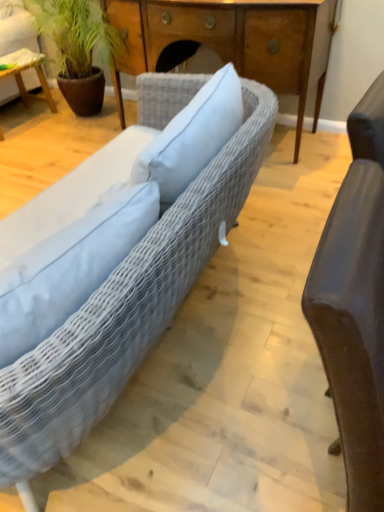
Question: From a real-world perspective, is matte brown leather chair at right positioned above or below green leafy plant at upper left?

Choices:
 (A) above
 (B) below

Answer: (A)

Question: Considering their positions, is matte brown leather chair at right located in front of or behind green leafy plant at upper left?

Choices:
 (A) front
 (B) behind

Answer: (A)

Question: Which of these objects is positioned farthest from the matte brown leather chair at right?

Choices:
 (A) wooden table at left
 (B) woven fabric couch at center
 (C) green leafy plant at upper left
 (D) wooden desk at center

Answer: (A)

Question: Which object is positioned closest to the green leafy plant at upper left?

Choices:
 (A) woven fabric couch at center
 (B) wooden desk at center
 (C) matte brown leather chair at right
 (D) wooden table at left

Answer: (D)